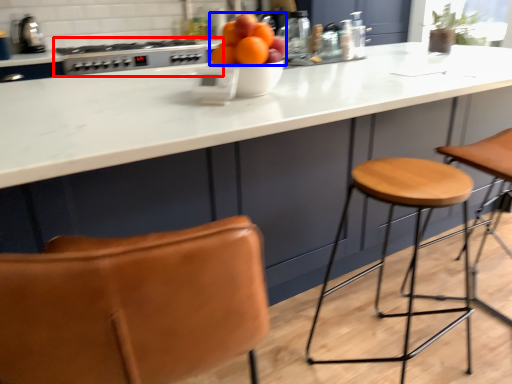
Question: Which object is closer to the camera taking this photo, gas stove (highlighted by a red box) or orange (highlighted by a blue box)?

Choices:
 (A) gas stove
 (B) orange

Answer: (B)